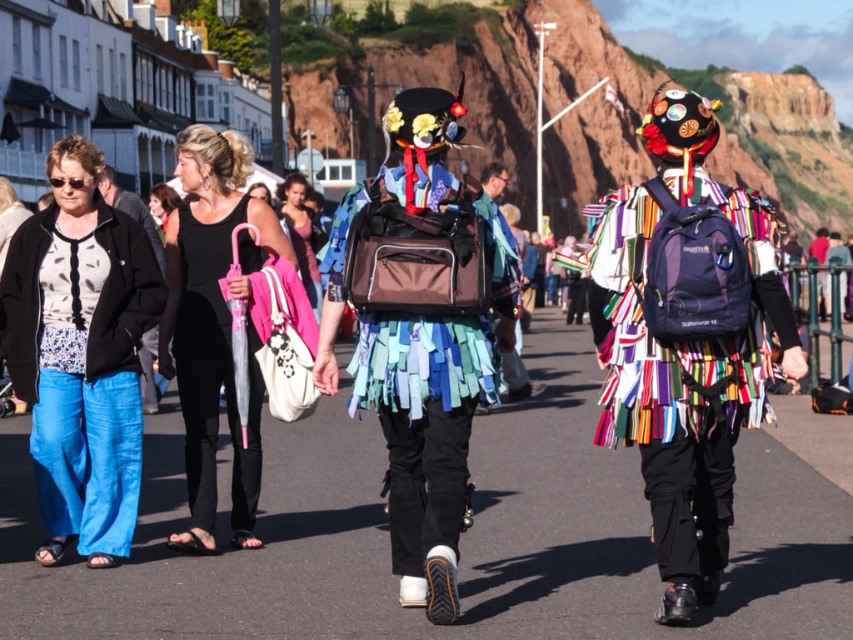
You are a photographer trying to capture both the multicolored fabric backpack at center and the black fabric dress at center in a single shot. Which object should you focus on first to ensure both are in frame?

You should focus on the multicolored fabric backpack at center first because it is in front of the black fabric dress at center, so adjusting the camera to include the backpack will naturally include the dress behind it.

You are a photographer trying to capture the vibrant costumes in the scene. You notice the denim pants at left and the textured fabric skirt at center. Which of these two items would likely be easier to fit into a tight frame without cropping, and why?

The denim pants at left occupies less space than the textured fabric skirt at center, so it would be easier to fit into a tight frame without cropping.